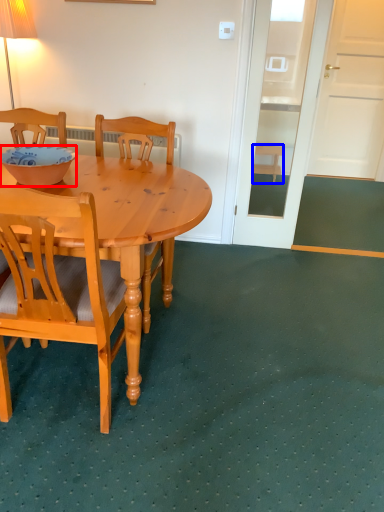
Question: Which of the following is the farthest to the observer, bowl (highlighted by a red box) or stool (highlighted by a blue box)?

Choices:
 (A) bowl
 (B) stool

Answer: (B)